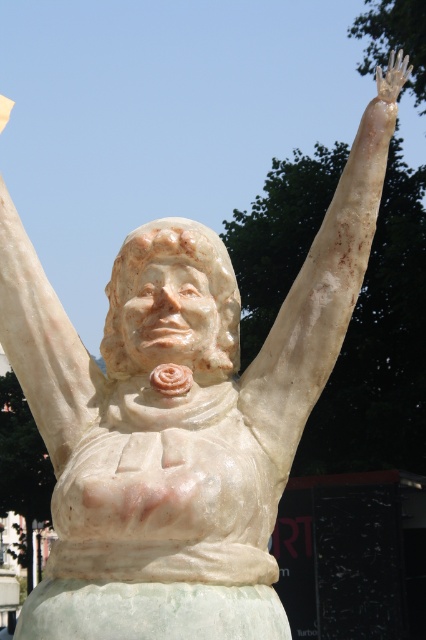
Is point (92, 380) positioned in front of point (396, 93)?

Yes, point (92, 380) is closer to viewer.

Based on the photo, is white marble statue arm at upper center bigger than white marble hand at upper right?

No, white marble statue arm at upper center is not bigger than white marble hand at upper right.

Between point (29, 356) and point (383, 92), which one is positioned in front?

Point (29, 356) is more forward.

The height and width of the screenshot is (640, 426). What are the coordinates of `white marble statue arm at upper center` in the screenshot? It's located at (43, 342).

Between white marble arm at upper right and white marble hand at upper right, which one has more height?

With more height is white marble hand at upper right.

Is white marble arm at upper right further to the viewer compared to white marble hand at upper right?

No, white marble arm at upper right is in front of white marble hand at upper right.

Who is more distant from viewer, (299, 428) or (408, 58)?

The point (408, 58) is behind.

Identify the location of white marble arm at upper right. The image size is (426, 640). (319, 298).

Is point (379, 173) farther from camera compared to point (14, 259)?

No, (379, 173) is in front of (14, 259).

Does point (363, 237) lie in front of point (39, 419)?

Yes, it is in front of point (39, 419).

In the scene shown: Who is more distant from viewer, (275, 445) or (16, 241)?

The point (16, 241) is behind.

Where is `white marble arm at upper right`? white marble arm at upper right is located at coordinates (319, 298).